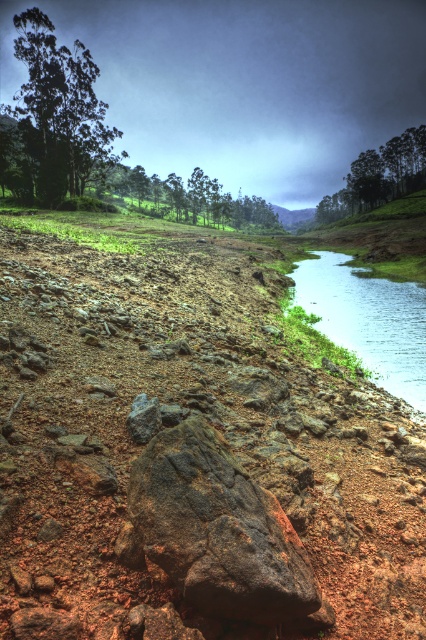
Question: Among these points, which one is nearest to the camera?

Choices:
 (A) (339, 198)
 (B) (253, 221)
 (C) (305, 563)
 (D) (405, 323)

Answer: (C)

Question: Does green leafy tree at upper left have a lesser width compared to clear water at river right?

Choices:
 (A) yes
 (B) no

Answer: (B)

Question: Can you confirm if green leafy tree at upper left is bigger than clear water at river right?

Choices:
 (A) no
 (B) yes

Answer: (B)

Question: Can you confirm if clear water at river right is positioned below green matte tree at center?

Choices:
 (A) no
 (B) yes

Answer: (B)

Question: Which object is closer to the camera taking this photo?

Choices:
 (A) rusty metallic boulder at center
 (B) green matte tree at upper right
 (C) green leafy tree at upper left
 (D) green matte tree at center

Answer: (A)

Question: Which point is farther from the camera taking this photo?

Choices:
 (A) (80, 45)
 (B) (405, 131)
 (C) (201, 195)
 (D) (399, 396)

Answer: (B)